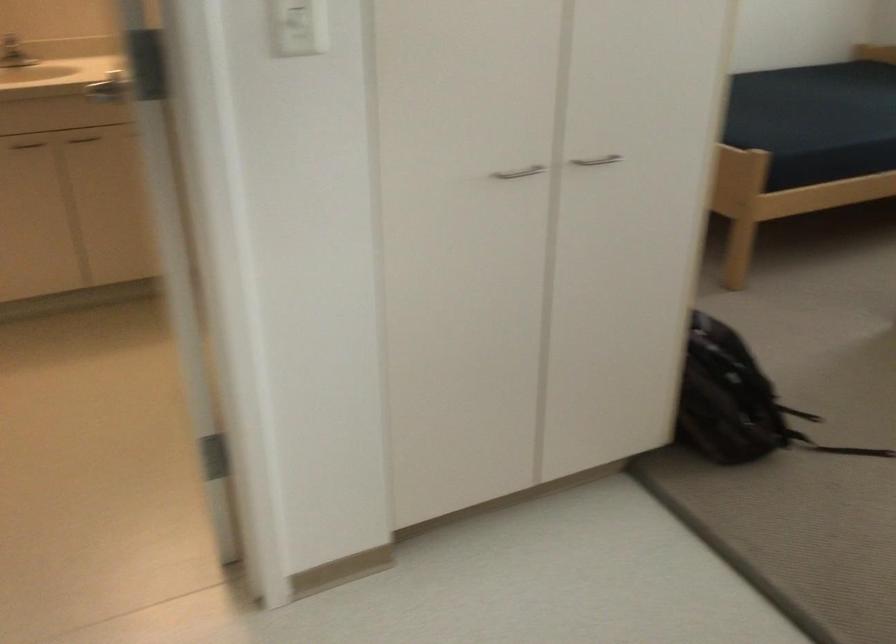
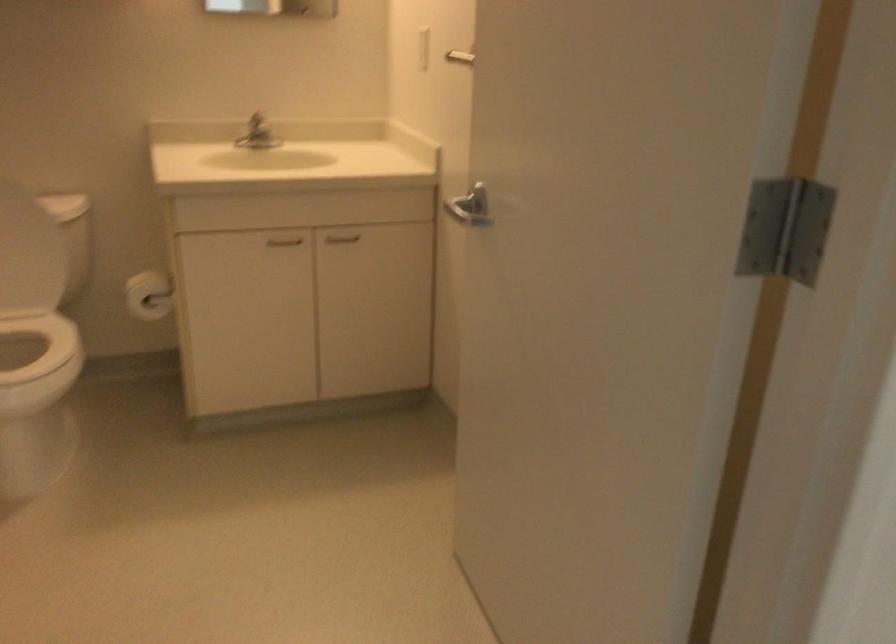
The point at (73, 138) is marked in the first image. Where is the corresponding point in the second image?

(341, 238)